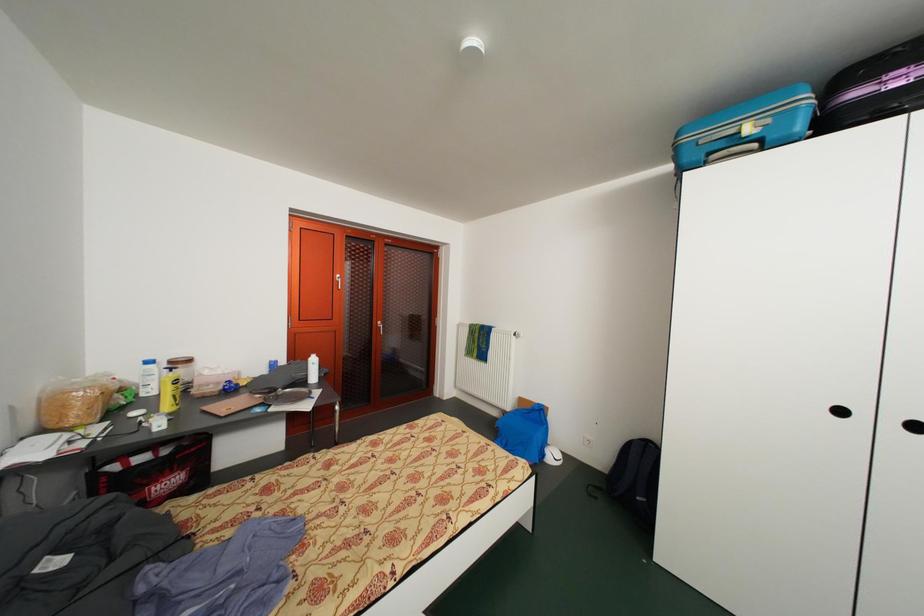
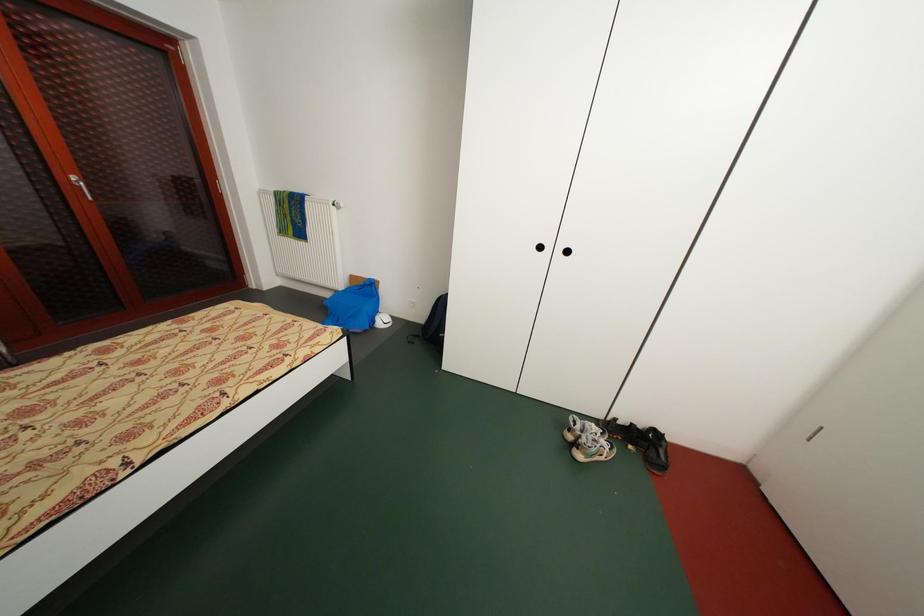
The images are taken continuously from a first-person perspective. In which direction is your viewpoint rotating?

The camera's rotation is toward right-down.